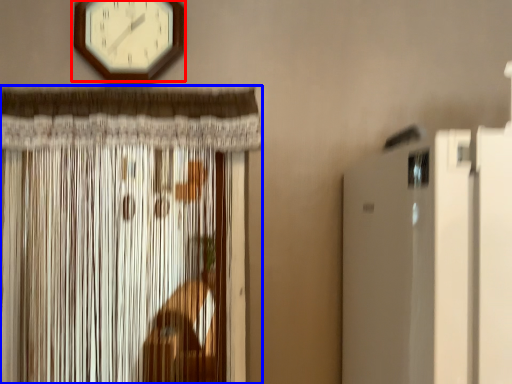
Question: Which of the following is the farthest to the observer, wall clock (highlighted by a red box) or curtain (highlighted by a blue box)?

Choices:
 (A) wall clock
 (B) curtain

Answer: (A)